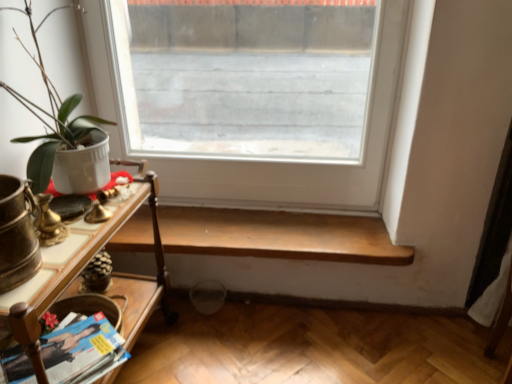
Question: Is matte paper magazine at lower left bigger or smaller than matte white pot at left?

Choices:
 (A) big
 (B) small

Answer: (B)

Question: Considering their positions, is matte paper magazine at lower left located in front of or behind matte white pot at left?

Choices:
 (A) behind
 (B) front

Answer: (A)

Question: Which is farther from the wooden table at left?

Choices:
 (A) matte white pot at left
 (B) clear glass window at center
 (C) matte paper magazine at lower left
 (D) wooden shelf at lower center

Answer: (B)

Question: Which object is positioned farthest from the matte white pot at left?

Choices:
 (A) matte paper magazine at lower left
 (B) wooden table at left
 (C) clear glass window at center
 (D) wooden shelf at lower center

Answer: (D)